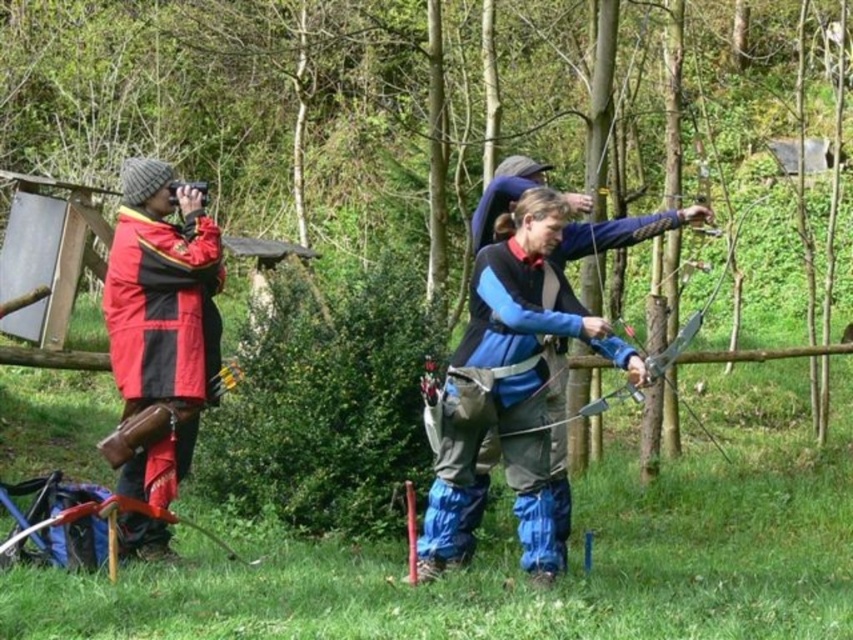
Looking at this image, you are a photographer standing at the edge of the forest. You need to take a photo of the blue matte archer at center without the red matte jacket at left appearing in the frame. Is this possible based on their current positions?

The blue matte archer at center is positioned under the red matte jacket at left, so adjusting your angle or moving to the side might allow you to capture the archer without the jacket in the frame.

You are an archer aiming to hit a target located at point (190, 458). There is an obstacle at point (451, 380). Will your arrow pass in front of or behind the obstacle?

The point (451, 380) is in front of point (190, 458). Therefore, the arrow will pass in front of the obstacle at point (451, 380) before reaching the target.

You are standing at the origin point in the archery scene. There is a point marked at coordinates (x=515, y=384). Which object is this point located on?

The point marked at coordinates (x=515, y=384) is located on the blue matte archer at center.